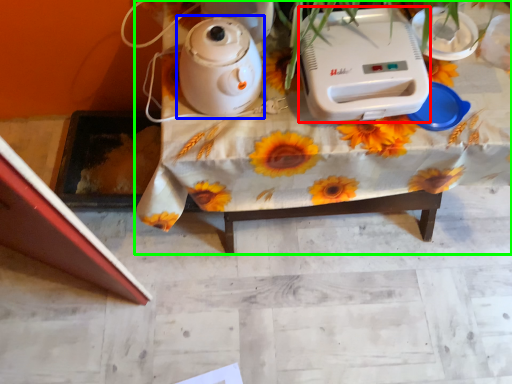
Question: Which object is the farthest from appliance (highlighted by a red box)? Choose among these: kettle (highlighted by a blue box) or table (highlighted by a green box).

Choices:
 (A) kettle
 (B) table

Answer: (A)